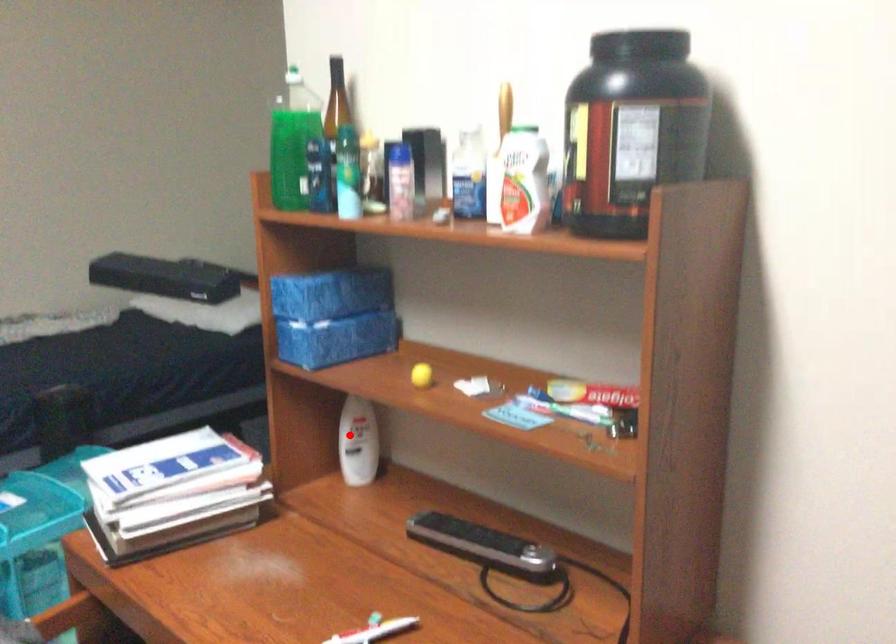
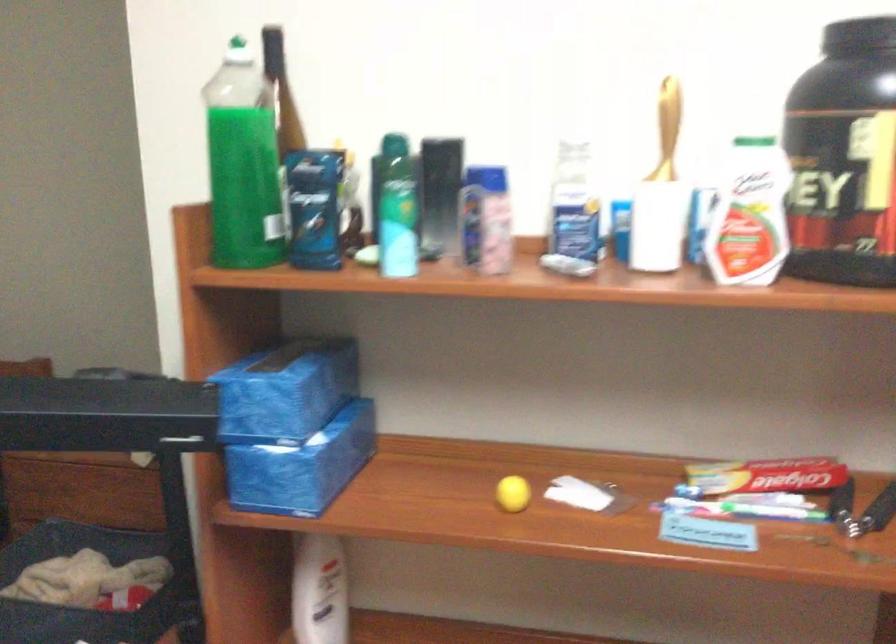
Where in the second image is the point corresponding to the highlighted location from the first image?

(319, 591)